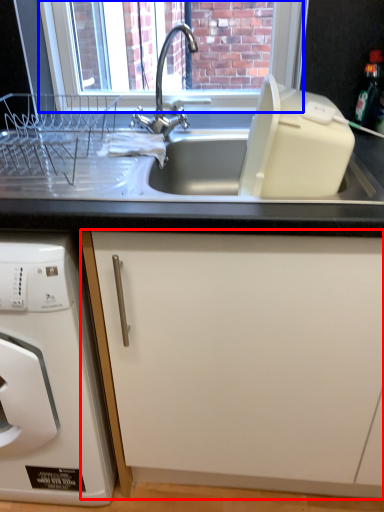
Question: Which object appears farthest to the camera in this image, cabinetry (highlighted by a red box) or window screen (highlighted by a blue box)?

Choices:
 (A) cabinetry
 (B) window screen

Answer: (B)